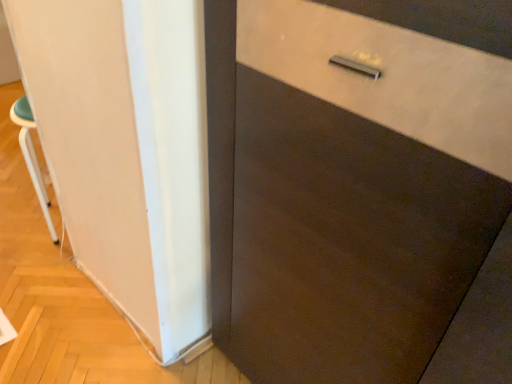
Question: Does white matte barn door at left appear on the right side of white plastic stool at left?

Choices:
 (A) no
 (B) yes

Answer: (B)

Question: Does white matte barn door at left have a greater width compared to white plastic stool at left?

Choices:
 (A) no
 (B) yes

Answer: (A)

Question: Can we say white matte barn door at left lies outside white plastic stool at left?

Choices:
 (A) yes
 (B) no

Answer: (A)

Question: Is white matte barn door at left shorter than white plastic stool at left?

Choices:
 (A) yes
 (B) no

Answer: (B)

Question: From the image's perspective, would you say white matte barn door at left is positioned over white plastic stool at left?

Choices:
 (A) yes
 (B) no

Answer: (B)

Question: Considering the relative sizes of white matte barn door at left and white plastic stool at left in the image provided, is white matte barn door at left bigger than white plastic stool at left?

Choices:
 (A) yes
 (B) no

Answer: (B)

Question: Does white plastic stool at left turn towards white matte barn door at left?

Choices:
 (A) no
 (B) yes

Answer: (A)

Question: Does white plastic stool at left have a greater width compared to white matte barn door at left?

Choices:
 (A) yes
 (B) no

Answer: (A)

Question: From a real-world perspective, is white plastic stool at left physically above white matte barn door at left?

Choices:
 (A) no
 (B) yes

Answer: (A)

Question: Is white matte barn door at left at the back of white plastic stool at left?

Choices:
 (A) yes
 (B) no

Answer: (B)

Question: Considering the relative positions of white plastic stool at left and white matte barn door at left in the image provided, is white plastic stool at left to the right of white matte barn door at left from the viewer's perspective?

Choices:
 (A) yes
 (B) no

Answer: (B)

Question: Is white plastic stool at left taller than white matte barn door at left?

Choices:
 (A) no
 (B) yes

Answer: (A)

Question: Choose the correct answer: Is white plastic stool at left inside white matte barn door at left or outside it?

Choices:
 (A) outside
 (B) inside

Answer: (A)